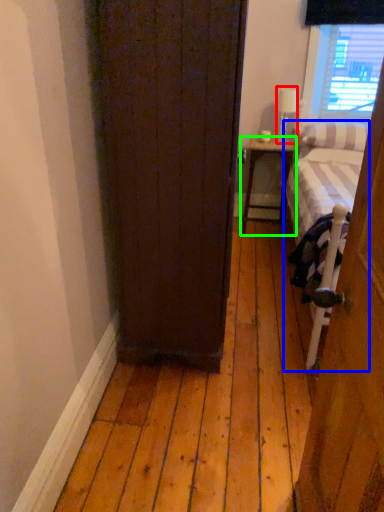
Question: Which object is positioned closest to lamp (highlighted by a red box)? Select from bed (highlighted by a blue box) and nightstand (highlighted by a green box).

Choices:
 (A) bed
 (B) nightstand

Answer: (B)